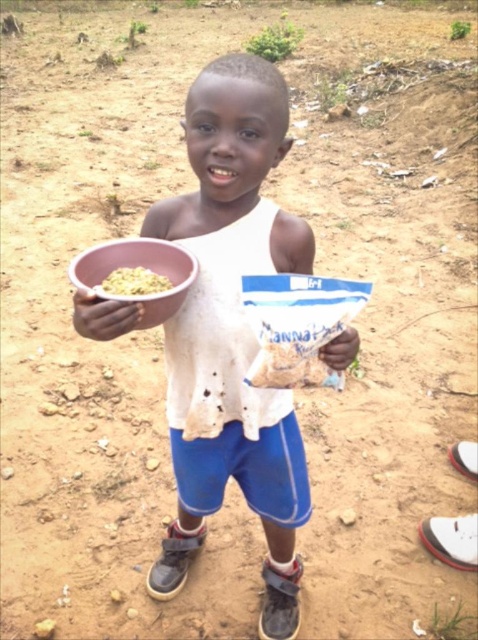
Question: Where is white matte shirt at center located in relation to yellow matte rice at upper left in the image?

Choices:
 (A) above
 (B) below

Answer: (B)

Question: In this image, where is white matte shirt at center located relative to pink plastic bowl at lower left?

Choices:
 (A) above
 (B) below

Answer: (B)

Question: Which object is the closest to the yellow matte rice at upper left?

Choices:
 (A) pink plastic bowl at lower left
 (B) white matte shirt at center
 (C) matte plastic bowl at left

Answer: (A)

Question: Among these points, which one is nearest to the camera?

Choices:
 (A) (99, 282)
 (B) (210, 480)

Answer: (A)

Question: Can you confirm if pink plastic bowl at lower left is bigger than yellow matte rice at upper left?

Choices:
 (A) no
 (B) yes

Answer: (B)

Question: Which of the following is the farthest from the observer?

Choices:
 (A) matte plastic bowl at left
 (B) yellow matte rice at upper left
 (C) white matte shirt at center

Answer: (B)